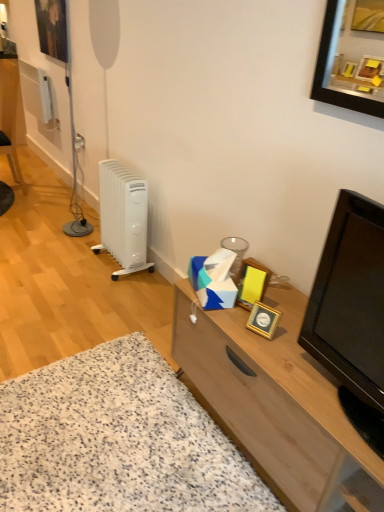
Image resolution: width=384 pixels, height=512 pixels. Identify the location of free spot to the right of gold metallic picture frame at center-right, the 1th picture frame viewed from the right. (291, 329).